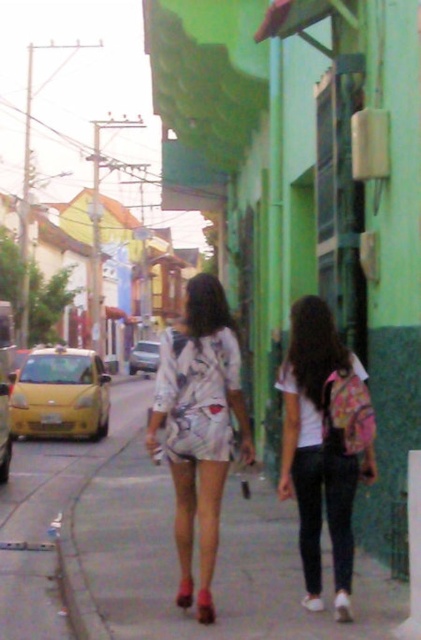
Question: Which object is positioned closest to the printed fabric dress at center?

Choices:
 (A) white matte shirt at center
 (B) smooth concrete sidewalk at center

Answer: (A)

Question: Can you confirm if smooth concrete sidewalk at center is wider than white matte shirt at center?

Choices:
 (A) yes
 (B) no

Answer: (B)

Question: Among these objects, which one is farthest from the camera?

Choices:
 (A) printed fabric dress at center
 (B) white matte shirt at center
 (C) smooth concrete sidewalk at center

Answer: (C)

Question: Which object is farther from the camera taking this photo?

Choices:
 (A) printed fabric dress at center
 (B) smooth concrete sidewalk at center
 (C) white matte shirt at center

Answer: (B)

Question: Can you confirm if white matte shirt at center is bigger than printed fabric dress at center?

Choices:
 (A) yes
 (B) no

Answer: (A)

Question: Is smooth concrete sidewalk at center further to camera compared to printed fabric dress at center?

Choices:
 (A) yes
 (B) no

Answer: (A)